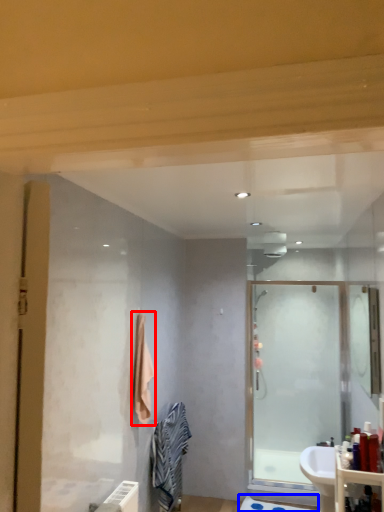
Question: Which of the following is the farthest to the observer, bath towel (highlighted by a red box) or bath mat (highlighted by a blue box)?

Choices:
 (A) bath towel
 (B) bath mat

Answer: (B)